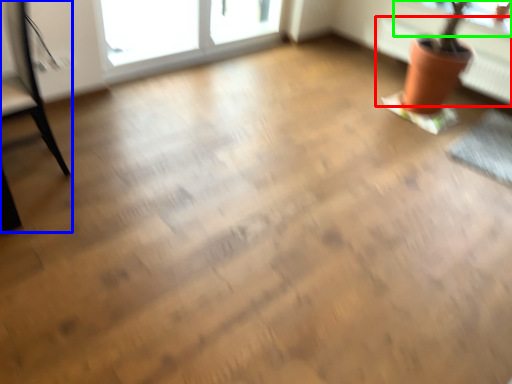
Question: Based on their relative distances, which object is nearer to radiator (highlighted by a red box)? Choose from armchair (highlighted by a blue box) and window screen (highlighted by a green box).

Choices:
 (A) armchair
 (B) window screen

Answer: (B)